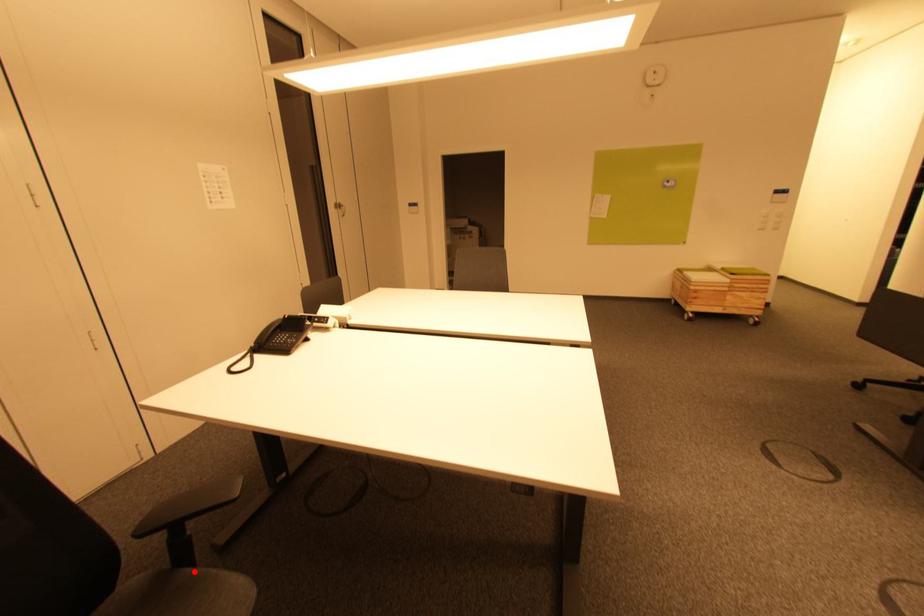
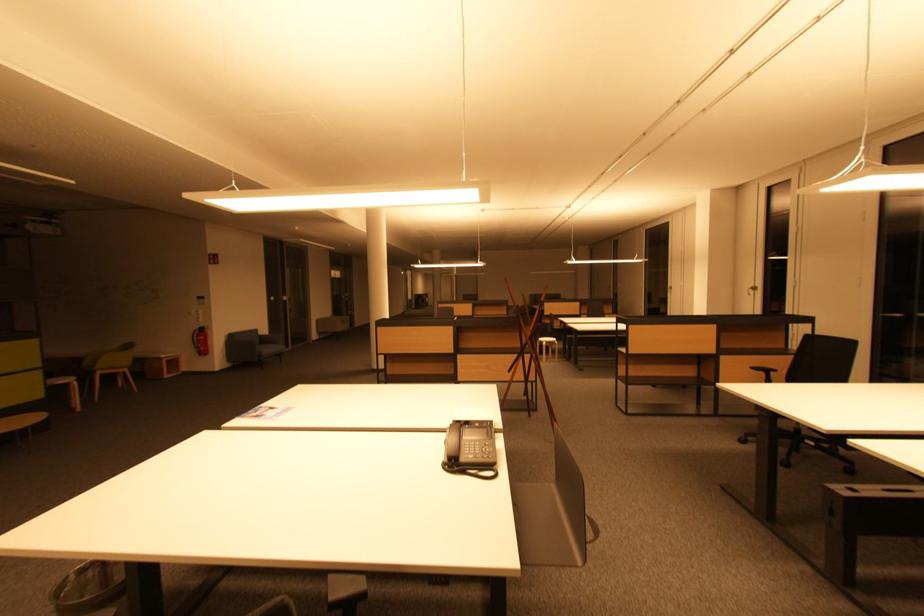
Question: I am providing you with two images of the same scene from different viewpoints. A red point is marked on the first image. Is the red point's position out of view in image 2?

Choices:
 (A) Yes
 (B) No

Answer: (A)